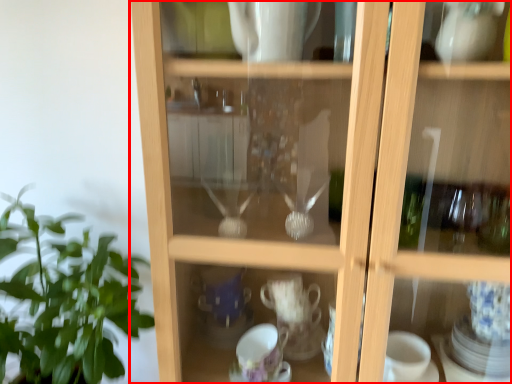
Question: From the image's perspective, considering the relative positions of cupboard (annotated by the red box) and houseplant in the image provided, where is cupboard (annotated by the red box) located with respect to the staircase?

Choices:
 (A) below
 (B) above

Answer: (B)